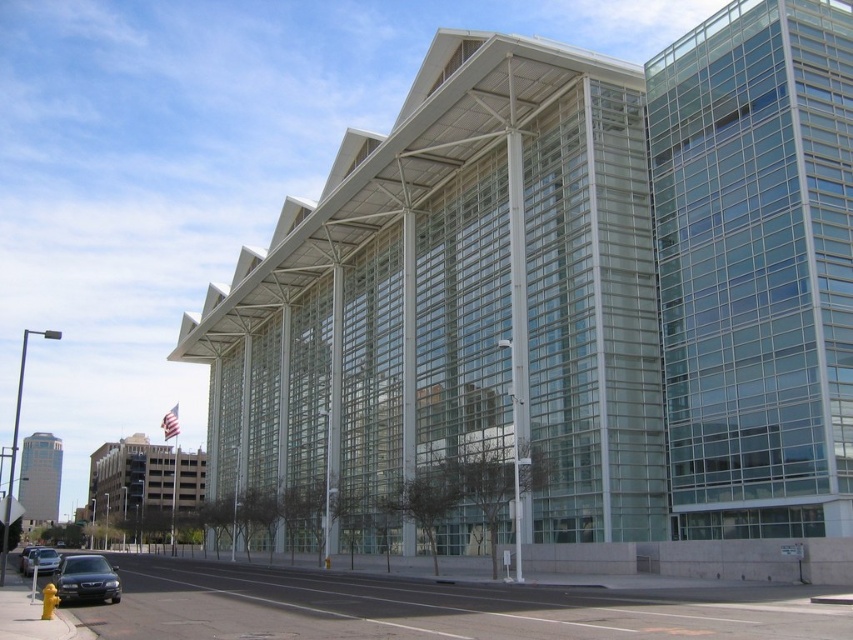
Question: Does matte black sedan at lower left have a greater width compared to shiny black sedan at lower left?

Choices:
 (A) no
 (B) yes

Answer: (B)

Question: Does matte black sedan at lower left have a greater width compared to shiny black sedan at lower left?

Choices:
 (A) no
 (B) yes

Answer: (B)

Question: Observing the image, what is the correct spatial positioning of matte black sedan at lower left in reference to shiny black sedan at lower left?

Choices:
 (A) above
 (B) below

Answer: (A)

Question: Among these points, which one is nearest to the camera?

Choices:
 (A) (48, 564)
 (B) (91, 592)

Answer: (B)

Question: Which object appears farthest from the camera in this image?

Choices:
 (A) shiny black sedan at lower left
 (B) matte black sedan at lower left

Answer: (A)